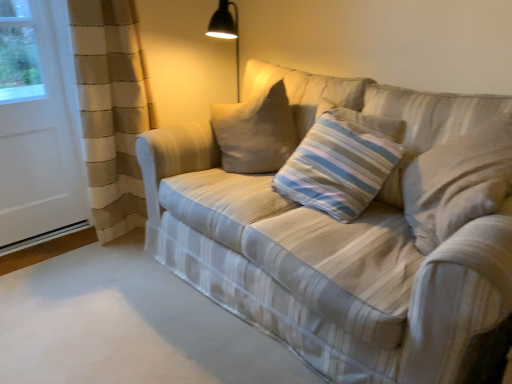
The height and width of the screenshot is (384, 512). Identify the location of white matte screen door at left. (35, 133).

In the image, there is a striped fabric pillow at center. At what (x,y) coordinates should I click in order to perform the action: click on studio couch below it (from the image's perspective). Please return your answer as a coordinate pair (x, y). The width and height of the screenshot is (512, 384). Looking at the image, I should click on [334, 243].

Is point (471, 321) closer or farther from the camera than point (302, 178)?

Point (471, 321) appears to be closer to the viewer than point (302, 178).

Considering the relative sizes of plaid fabric couch at center and striped fabric pillow at center in the image provided, is plaid fabric couch at center wider than striped fabric pillow at center?

Yes, plaid fabric couch at center is wider than striped fabric pillow at center.

Could you tell me if plaid fabric couch at center is turned towards striped fabric pillow at center?

Yes, plaid fabric couch at center faces towards striped fabric pillow at center.

From a real-world perspective, which object rests below the other?

striped fabric pillow at center is physically lower.

Consider the image. Could you tell me if white matte screen door at left is facing striped fabric pillow at center?

No, white matte screen door at left is not oriented towards striped fabric pillow at center.

Find the location of `screen door that is above the striped fabric pillow at center (from a real-world perspective)`. screen door that is above the striped fabric pillow at center (from a real-world perspective) is located at coordinates (35, 133).

From the image's perspective, is white matte screen door at left located beneath striped fabric pillow at center?

No, from the image's perspective, white matte screen door at left is not beneath striped fabric pillow at center.

From the image's perspective, would you say plaid fabric couch at center is positioned over white matte screen door at left?

Actually, plaid fabric couch at center appears below white matte screen door at left in the image.

Measure the distance from plaid fabric couch at center to white matte screen door at left.

plaid fabric couch at center and white matte screen door at left are 1.14 meters apart from each other.

Is white matte screen door at left located within plaid fabric couch at center?

No, white matte screen door at left is not inside plaid fabric couch at center.

Which of these two, plaid fabric couch at center or white matte screen door at left, is wider?

plaid fabric couch at center.

Is striped fabric pillow at center facing away from plaid fabric couch at center?

Absolutely, striped fabric pillow at center is directed away from plaid fabric couch at center.

Which of these two, striped fabric pillow at center or plaid fabric couch at center, stands shorter?

Result: Standing shorter between the two is striped fabric pillow at center.

Is point (310, 138) positioned behind point (397, 354)?

Yes.

In the image, is white matte screen door at left positioned in front of or behind plaid fabric couch at center?

white matte screen door at left is positioned farther from the viewer than plaid fabric couch at center.

Considering the sizes of objects white matte screen door at left and plaid fabric couch at center in the image provided, who is thinner, white matte screen door at left or plaid fabric couch at center?

white matte screen door at left is thinner.

From the image's perspective, is white matte screen door at left over plaid fabric couch at center?

Yes, from the image's perspective, white matte screen door at left is over plaid fabric couch at center.

Between white matte screen door at left and plaid fabric couch at center, which one appears on the right side from the viewer's perspective?

A: Positioned to the right is plaid fabric couch at center.

From the image's perspective, does striped fabric pillow at center appear higher than white matte screen door at left?

No, from the image's perspective, striped fabric pillow at center is not over white matte screen door at left.

Which is behind, point (293, 153) or point (24, 158)?

The point (24, 158) is farther.

Relative to white matte screen door at left, is striped fabric pillow at center in front or behind?

striped fabric pillow at center is in front of white matte screen door at left.

Is striped fabric pillow at center facing towards white matte screen door at left?

No, striped fabric pillow at center is not facing towards white matte screen door at left.

This screenshot has height=384, width=512. I want to click on studio couch beneath the striped fabric pillow at center (from a real-world perspective), so click(x=334, y=243).

Where is `screen door that is behind the striped fabric pillow at center`? The width and height of the screenshot is (512, 384). screen door that is behind the striped fabric pillow at center is located at coordinates (35, 133).

From the image, which object appears to be nearer to plaid fabric couch at center, striped fabric pillow at center or white matte screen door at left?

Based on the image, striped fabric pillow at center appears to be nearer to plaid fabric couch at center.

Looking at the image, which one is located further to striped fabric pillow at center, plaid fabric couch at center or white matte screen door at left?

Among the two, white matte screen door at left is located further to striped fabric pillow at center.

Considering their positions, is striped fabric pillow at center positioned further to white matte screen door at left than plaid fabric couch at center?

striped fabric pillow at center.

Looking at the image, which one is located further to plaid fabric couch at center, white matte screen door at left or striped fabric pillow at center?

Among the two, white matte screen door at left is located further to plaid fabric couch at center.

Estimate the real-world distances between objects in this image. Which object is further from white matte screen door at left, plaid fabric couch at center or striped fabric pillow at center?

striped fabric pillow at center is further to white matte screen door at left.

Based on the photo, considering their positions, is white matte screen door at left positioned further to striped fabric pillow at center than plaid fabric couch at center?

white matte screen door at left.

Image resolution: width=512 pixels, height=384 pixels. Identify the location of studio couch between white matte screen door at left and striped fabric pillow at center in the horizontal direction. (334, 243).